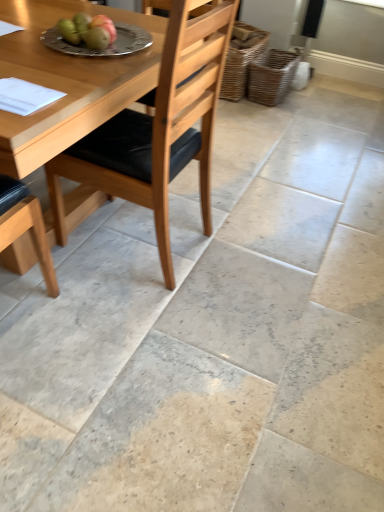
Locate an element on the screen. This screenshot has height=512, width=384. vacant space in front of green matte pear at upper left, which appears as the 2th fruit when viewed from the left is located at coordinates (73, 64).